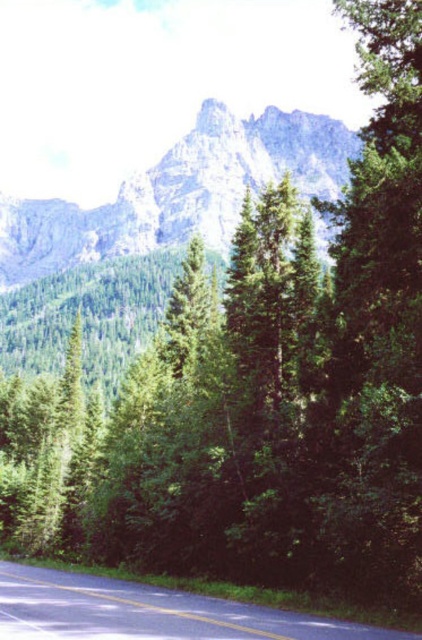
You are standing at the starting point of the paved road in the foreground. Looking towards the mountains, can you tell me what specific geographic feature is located at the coordinate point (178, 193) in the image?

The point at coordinate (178, 193) corresponds to a gray rocky mountain at upper center.

You are a hiker planning to take a photo of the gray rocky mountain at upper center and the smooth asphalt road at lower center. Which object will appear larger in your photo?

The gray rocky mountain at upper center will appear larger in the photo because it is taller than the smooth asphalt road at lower center.

You are a photographer planning to capture a wide shot of the gray rocky mountain at upper center and the smooth asphalt road at lower center. Given that the mountain is wider than the road, how should you adjust your camera frame to ensure both are fully visible?

Since the gray rocky mountain at upper center is wider than the smooth asphalt road at lower center, you should position the camera frame to give more horizontal space to the mountain while still including the road in the lower part of the image.